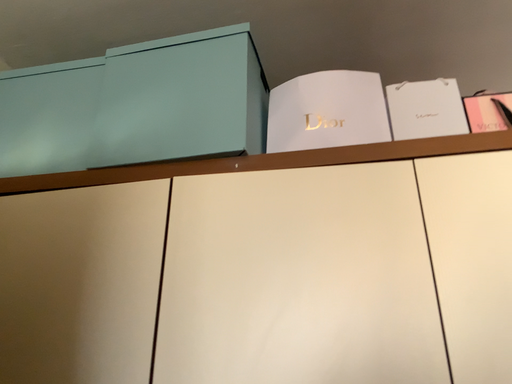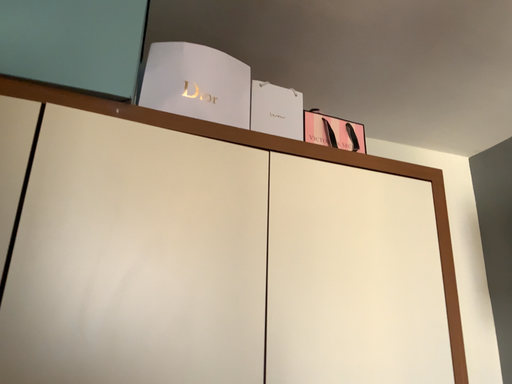
Question: How did the camera likely rotate when shooting the video?

Choices:
 (A) rotated right
 (B) rotated left

Answer: (A)